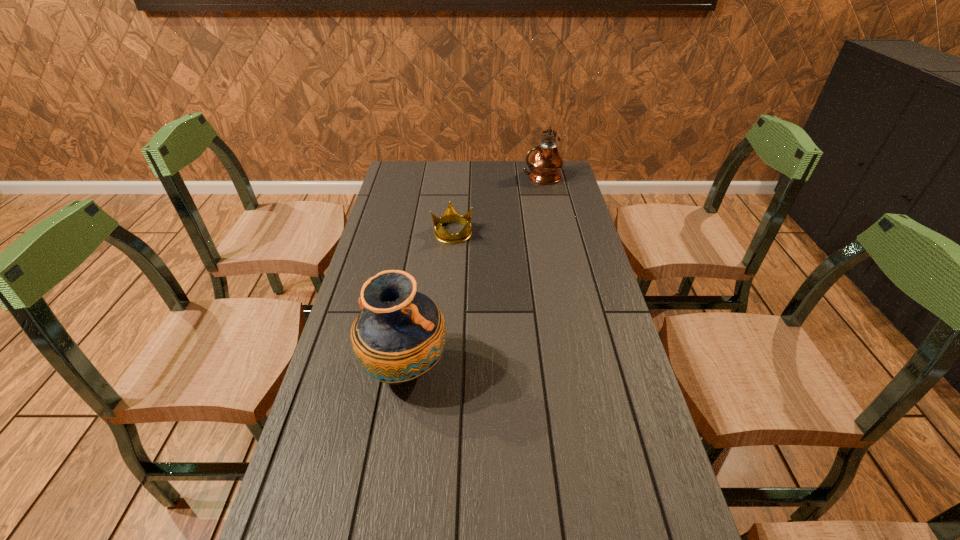
The image size is (960, 540). I want to click on object that is at the left edge, so (x=399, y=335).

Find the location of `object present at the right edge`. object present at the right edge is located at coordinates (545, 165).

What are the coordinates of `object located in the far right corner section of the desktop` in the screenshot? It's located at (545, 165).

Identify the location of vacant space at the far edge. (485, 164).

This screenshot has width=960, height=540. Find the location of `vacant region at the left edge of the desktop`. vacant region at the left edge of the desktop is located at coordinates (334, 447).

Where is `free space at the right edge`? Image resolution: width=960 pixels, height=540 pixels. free space at the right edge is located at coordinates (585, 248).

You are a GUI agent. You are given a task and a screenshot of the screen. Output one action in this format:
    pyautogui.click(x=<x>, y=<y>)
    Task: Click on the free space at the far left corner of the desktop
    The width and height of the screenshot is (960, 540).
    Given the screenshot: What is the action you would take?
    pyautogui.click(x=396, y=177)

Identify the location of vacant area that lies between the second nearest object and the oil lamp. The height and width of the screenshot is (540, 960). (497, 205).

Find the location of a particular element. empty space between the farthest object and the nearest object is located at coordinates (473, 273).

Choose which object is the second nearest neighbor to the oil lamp. Please provide its 2D coordinates. Your answer should be formatted as a tuple, i.e. [(x, y)], where the tuple contains the x and y coordinates of a point satisfying the conditions above.

[(399, 335)]